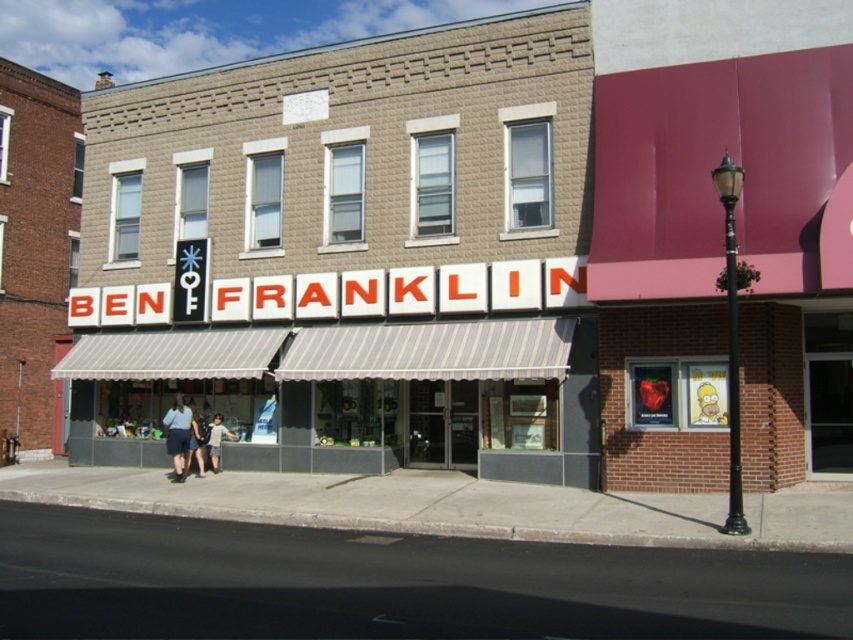
Does denim shorts at lower left have a lesser width compared to light blue denim shorts at center?

No, denim shorts at lower left is not thinner than light blue denim shorts at center.

Measure the distance between point (181, 419) and camera.

Point (181, 419) is 17.77 meters away from camera.

At what (x,y) coordinates should I click in order to perform the action: click on denim shorts at lower left. Please return your answer as a coordinate pair (x, y). Looking at the image, I should click on (178, 435).

Which is more to the left, light blue denim shorts at center or denim shorts at center?

light blue denim shorts at center

Can you confirm if light blue denim shorts at center is taller than denim shorts at center?

Indeed, light blue denim shorts at center has a greater height compared to denim shorts at center.

Which is in front, point (190, 426) or point (215, 445)?

Point (190, 426)

The image size is (853, 640). Find the location of `light blue denim shorts at center`. light blue denim shorts at center is located at coordinates (195, 442).

Which is more to the right, denim shorts at lower left or denim shorts at center?

From the viewer's perspective, denim shorts at center appears more on the right side.

Describe the element at coordinates (178, 435) in the screenshot. The width and height of the screenshot is (853, 640). I see `denim shorts at lower left` at that location.

Looking at this image, who is more forward, (183, 449) or (212, 448)?

Point (183, 449) is more forward.

The image size is (853, 640). I want to click on denim shorts at lower left, so click(x=178, y=435).